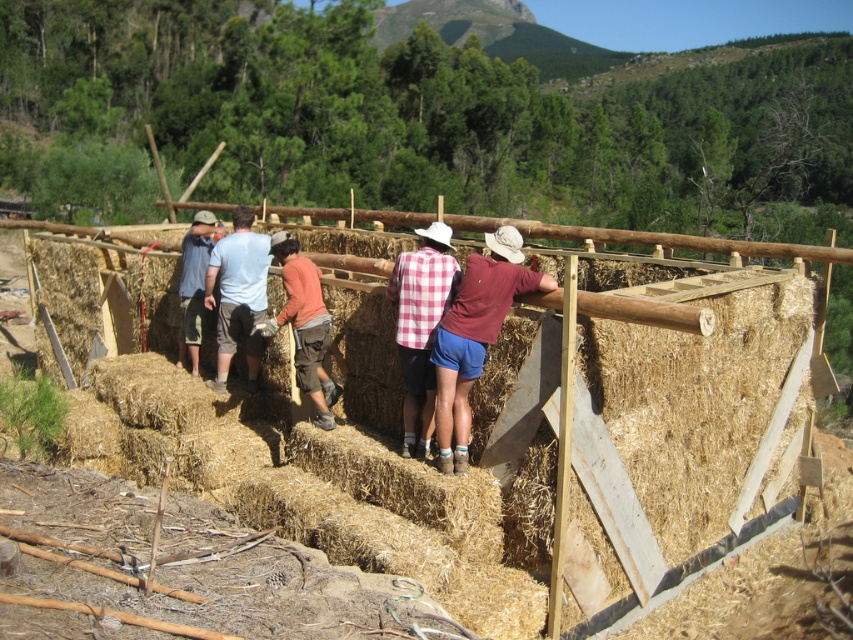
You are a construction worker in the scene. You need to hand a tool to the person wearing the orange shirt at center and the blue denim jeans at center. Which clothing item should you target if you want to reach the smaller one first?

The orange shirt at center is smaller than the blue denim jeans at center, so you should target the orange shirt at center first.

You are a construction worker standing at the edge of the construction site. You see the natural straw bales at center and the orange shirt at center. Which object is positioned higher from the ground?

The natural straw bales at center are located above the orange shirt at center, so they are positioned higher from the ground.